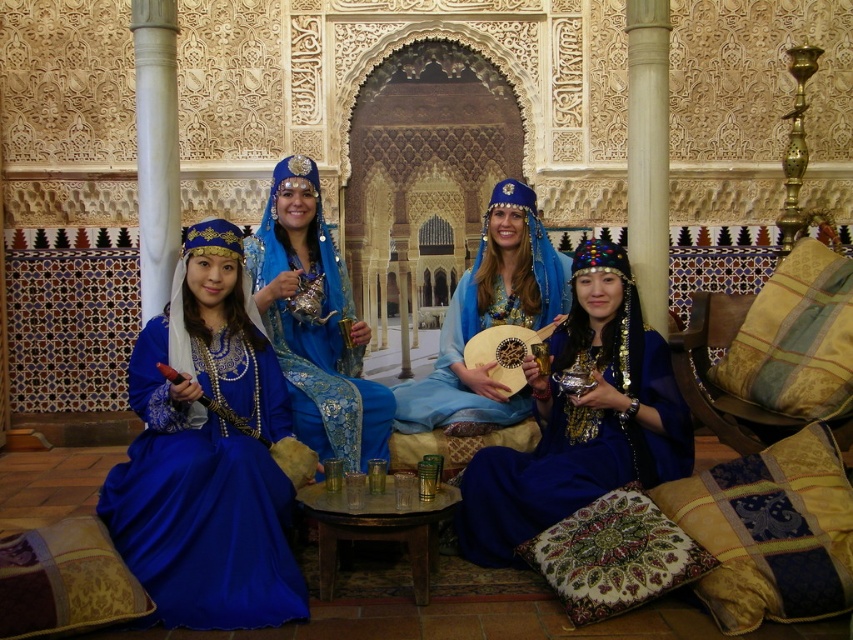
You are a photographer standing in the palace room. You see two points in the scene, one at point (148, 412) and the other at point (831, 580). Which point is closer to your camera?

Point (148, 412) is closer to the camera than point (831, 580) because it is further to the camera than the other point.